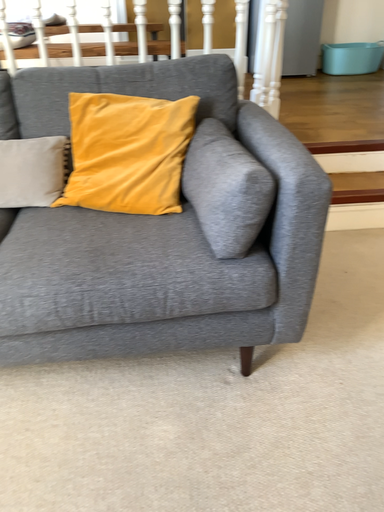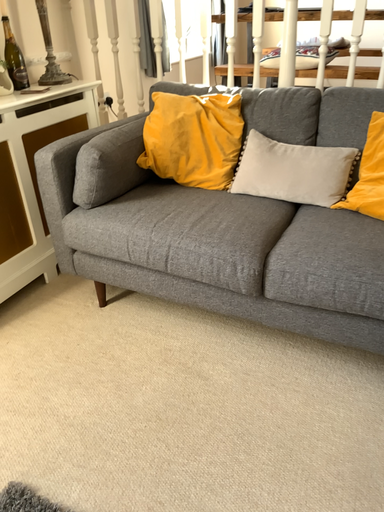
Question: Which way did the camera rotate in the video?

Choices:
 (A) rotated left
 (B) rotated right

Answer: (A)